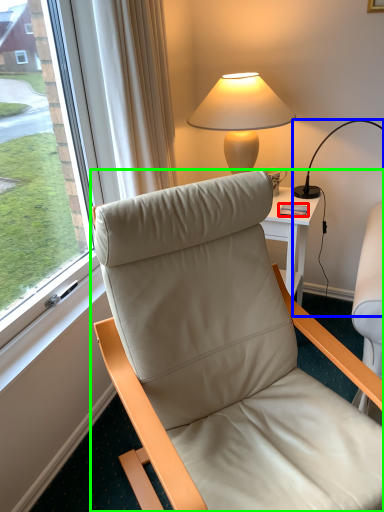
Question: Which object is positioned farthest from mobile phone (highlighted by a red box)? Select from lamp (highlighted by a blue box) and chair (highlighted by a green box).

Choices:
 (A) lamp
 (B) chair

Answer: (B)